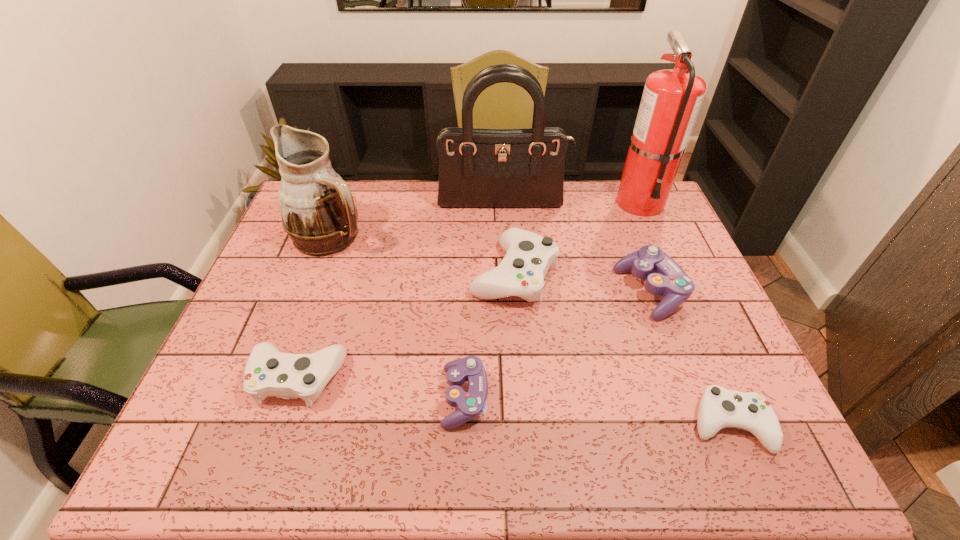
Find the location of a particular element. This screenshot has width=960, height=540. red fire extinguisher is located at coordinates (671, 98).

Image resolution: width=960 pixels, height=540 pixels. Find the location of `black handbag`. black handbag is located at coordinates (478, 168).

The width and height of the screenshot is (960, 540). In order to click on brown pitcher in this screenshot , I will do `click(318, 212)`.

Where is `the sixth shortest object`? the sixth shortest object is located at coordinates (318, 212).

Identify the location of the biggest white control. This screenshot has height=540, width=960. (528, 257).

Where is `the farthest white control`? The height and width of the screenshot is (540, 960). the farthest white control is located at coordinates (528, 257).

The image size is (960, 540). What are the coordinates of `the farther purple control` in the screenshot? It's located at (664, 276).

Where is `the bigger purple control`? The image size is (960, 540). the bigger purple control is located at coordinates (664, 276).

In order to click on the leftmost white control in this screenshot , I will do `click(268, 372)`.

Locate an element on the screen. The width and height of the screenshot is (960, 540). the second biggest white control is located at coordinates (268, 372).